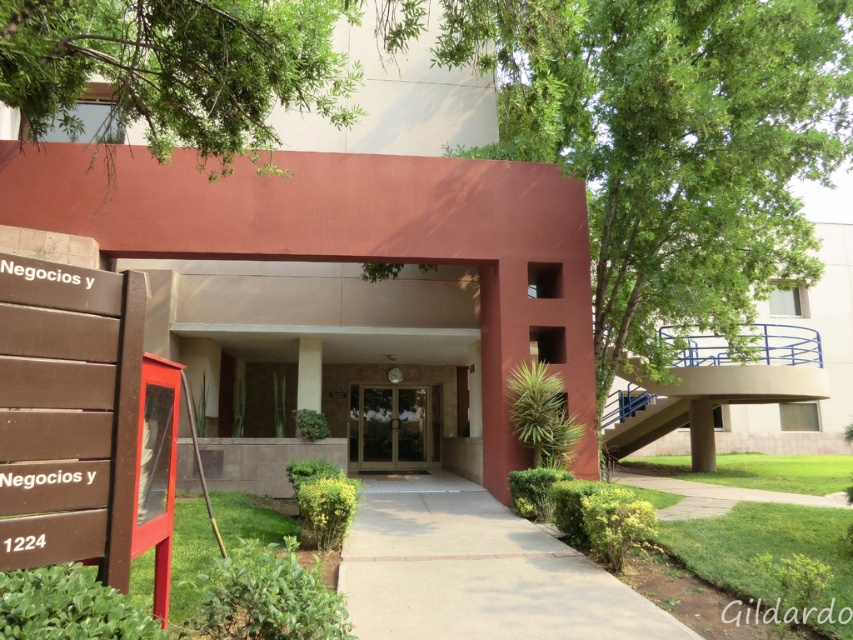
You are standing at the entrance of the modern building and want to reach the point marked at coordinates (x=39, y=532). Given that the distance between you and this point is 8.65 feet, can you comfortably walk to it without any obstacles?

The point at coordinates (x=39, y=532) is 8.65 feet away from you. Since there are no mentioned obstacles in the scene description, you can comfortably walk to it.